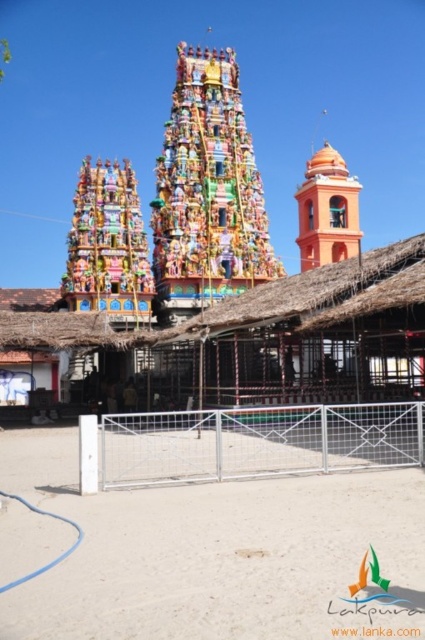
Question: Among these points, which one is farthest from the camera?

Choices:
 (A) (345, 225)
 (B) (385, 481)
 (C) (283, 308)
 (D) (246, 214)

Answer: (A)

Question: Which object is the closest to the white sandy ground at lower center?

Choices:
 (A) thatched straw hut at center
 (B) multicolored painted temple at center

Answer: (A)

Question: Among these points, which one is farthest from the camera?

Choices:
 (A) (334, 186)
 (B) (254, 164)
 (C) (258, 323)
 (D) (51, 608)

Answer: (A)

Question: Can you confirm if multicolored painted temple at center is positioned to the right of orange matte bell tower at upper right?

Choices:
 (A) yes
 (B) no

Answer: (B)

Question: Can you confirm if thatched straw hut at center is positioned above multicolored painted temple at center?

Choices:
 (A) yes
 (B) no

Answer: (B)

Question: Is thatched straw hut at center to the right of orange matte bell tower at upper right from the viewer's perspective?

Choices:
 (A) yes
 (B) no

Answer: (B)